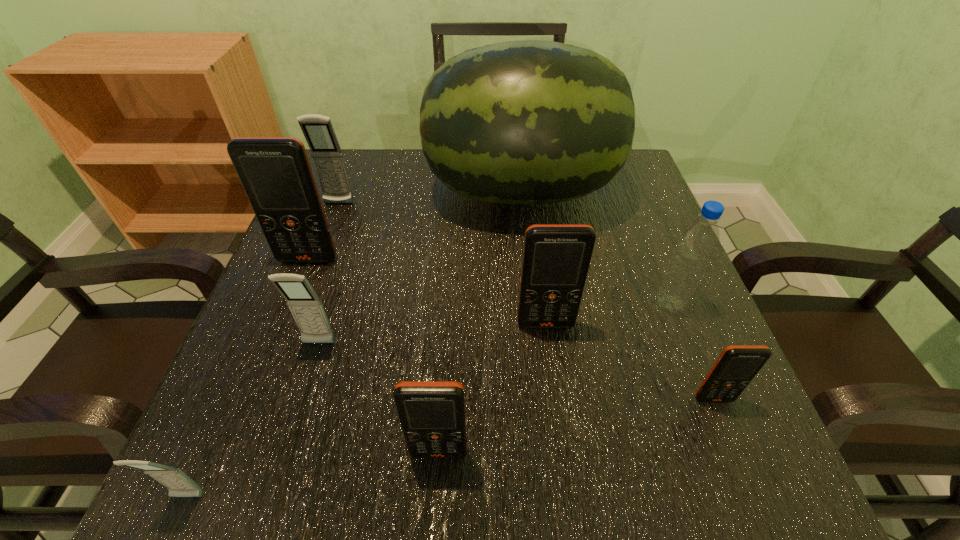
Where is `the fourth farthest cellular telephone`? This screenshot has height=540, width=960. the fourth farthest cellular telephone is located at coordinates (306, 307).

Identify the location of the fifth cellular telephone from left to right. The image size is (960, 540). (432, 413).

Locate an element on the screen. the third orange cellular telephone from right to left is located at coordinates [x=432, y=413].

Find the location of a particular element. the third farthest orange cellular telephone is located at coordinates (736, 366).

The height and width of the screenshot is (540, 960). In order to click on the smallest orange cellular telephone in this screenshot , I will do `click(736, 366)`.

At what (x,y) coordinates should I click in order to perform the action: click on the nearest object. Please return your answer as a coordinate pair (x, y). The image size is (960, 540). Looking at the image, I should click on (178, 483).

Where is `the smallest gray cellular telephone`? This screenshot has width=960, height=540. the smallest gray cellular telephone is located at coordinates (178, 483).

You are a GUI agent. You are given a task and a screenshot of the screen. Output one action in this format:
    pyautogui.click(x=<x>, y=<y>)
    Task: Click on the vacant space situated 0.280m on the left of the green watermelon
    
    Given the screenshot: What is the action you would take?
    pyautogui.click(x=310, y=192)

You are a GUI agent. You are given a task and a screenshot of the screen. Output one action in this format:
    pyautogui.click(x=<x>, y=<y>)
    Task: Click on the free space located on the screen of the leftmost orange cellular telephone
    The width and height of the screenshot is (960, 540).
    Given the screenshot: What is the action you would take?
    pyautogui.click(x=266, y=368)

The image size is (960, 540). What are the coordinates of `vacant space located on the front-facing side of the biggest gray cellular telephone` in the screenshot? It's located at (324, 242).